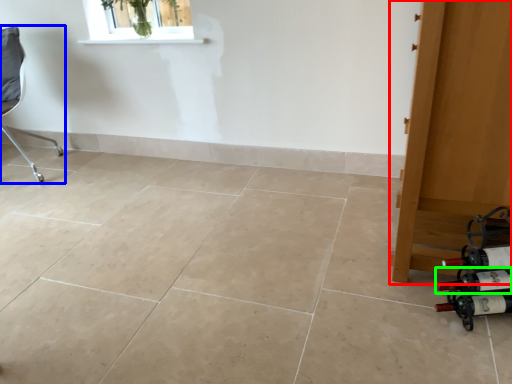
Question: Considering the real-world distances, which object is closest to door (highlighted by a red box)? chair (highlighted by a blue box) or wine bottle (highlighted by a green box).

Choices:
 (A) chair
 (B) wine bottle

Answer: (B)